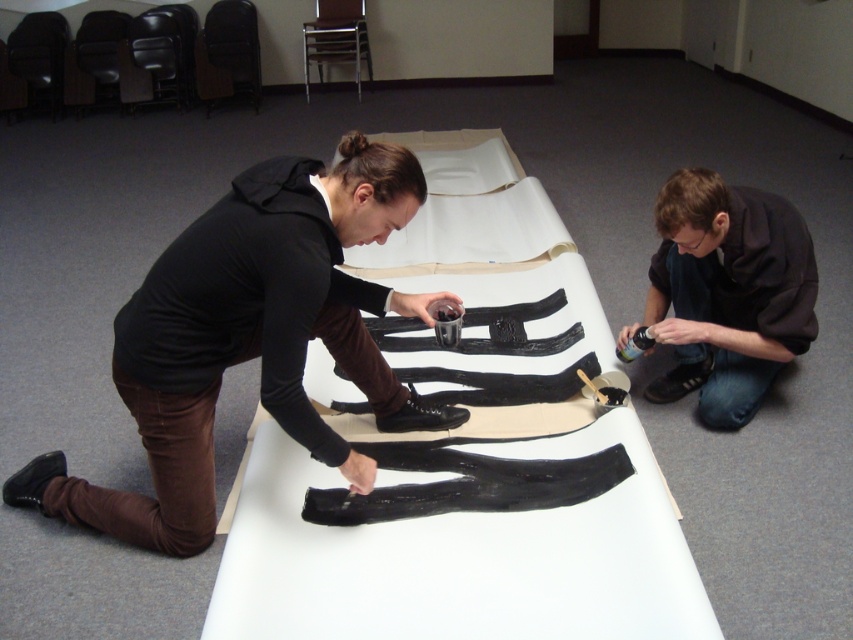
Question: Which point appears closest to the camera in this image?

Choices:
 (A) click(730, 333)
 (B) click(659, 576)
 (C) click(190, 432)

Answer: (B)

Question: Which object is farther from the camera taking this photo?

Choices:
 (A) black matte shirt at lower right
 (B) white paper at center

Answer: (A)

Question: Is white paper at center to the left of black matte shirt at lower right from the viewer's perspective?

Choices:
 (A) no
 (B) yes

Answer: (B)

Question: Which of these objects is positioned closest to the white paper at center?

Choices:
 (A) matte black shoes at center
 (B) black matte shirt at lower right

Answer: (B)

Question: Is white paper at center above black matte shirt at lower right?

Choices:
 (A) yes
 (B) no

Answer: (B)

Question: Is white paper at center below black matte shirt at lower right?

Choices:
 (A) yes
 (B) no

Answer: (A)